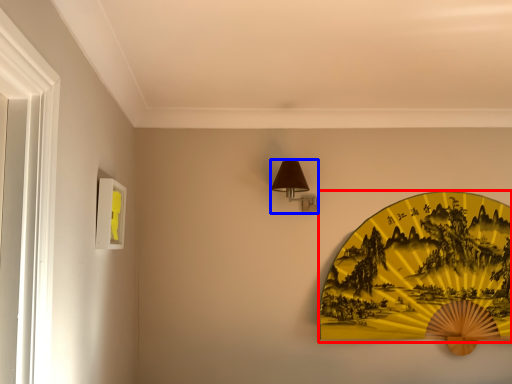
Question: Which of the following is the closest to the observer, design (highlighted by a red box) or table lamp (highlighted by a blue box)?

Choices:
 (A) design
 (B) table lamp

Answer: (B)